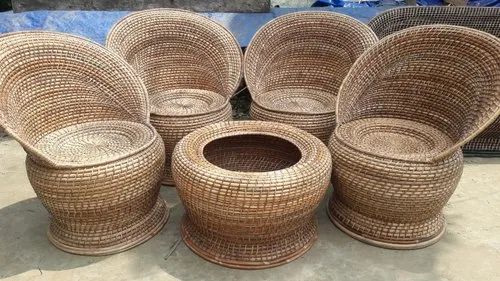
This screenshot has height=281, width=500. Find the location of `base of rightmost chair`. base of rightmost chair is located at coordinates (382, 235).